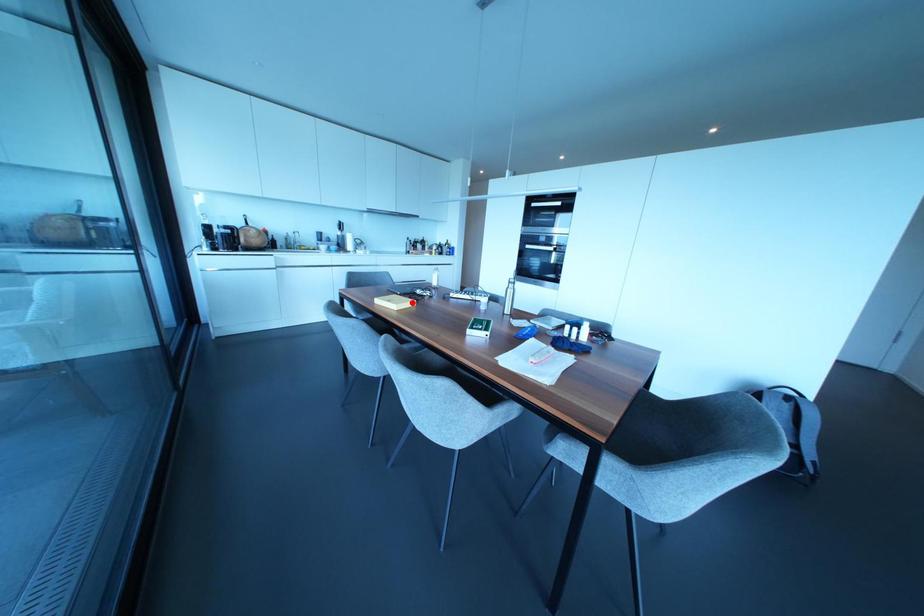
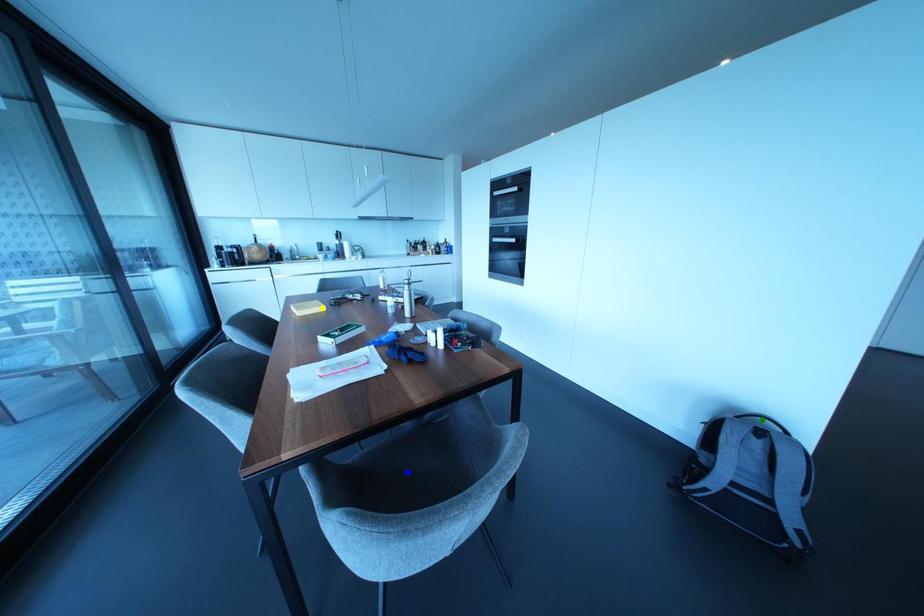
Question: I am providing you with two images of the same scene from different viewpoints. A red point is marked on the first image. You are given multiple points on the second image. Which spot in image 2 lines up with the point in image 1?

Choices:
 (A) blue point
 (B) green point
 (C) yellow point

Answer: (C)